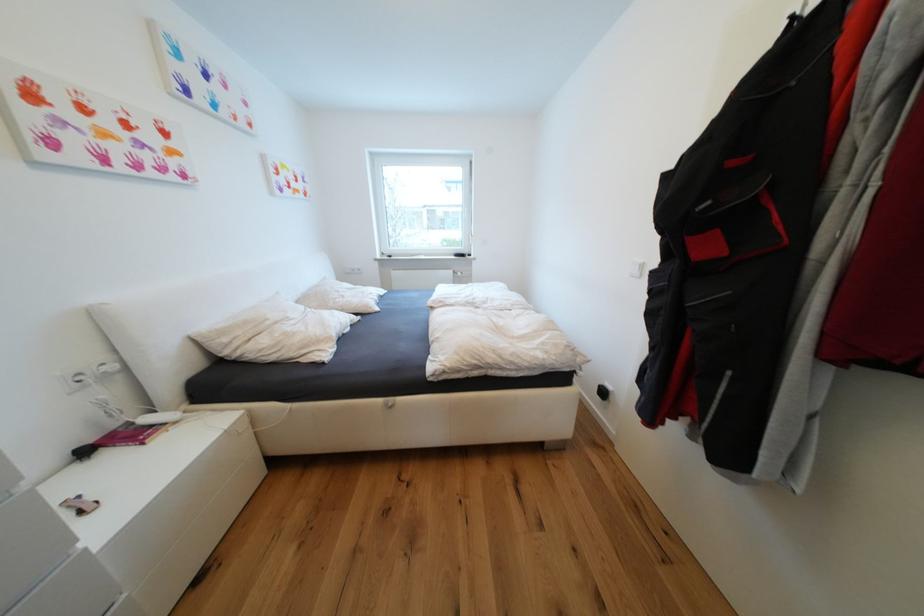
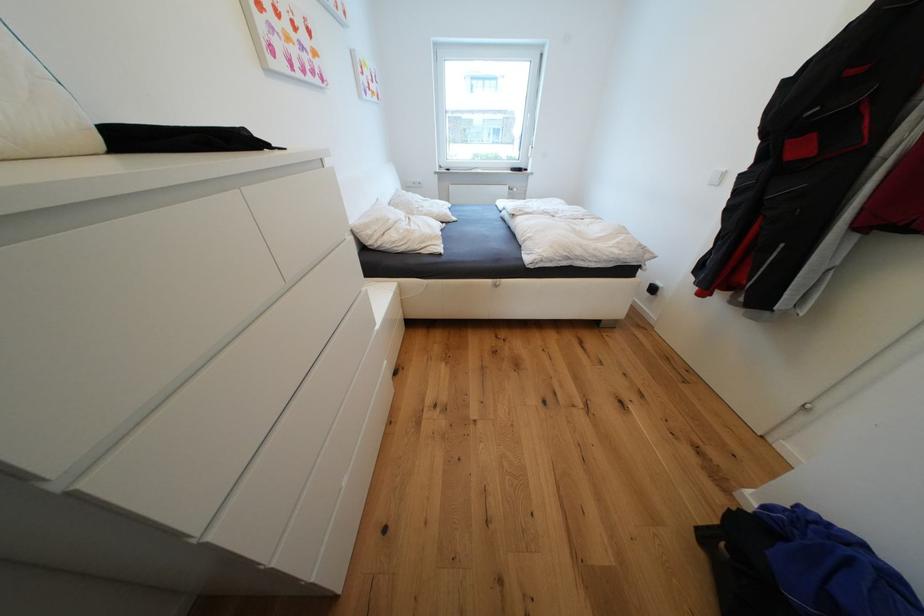
Where in the second image is the point corresponding to (x=458, y=273) from the first image?

(515, 188)